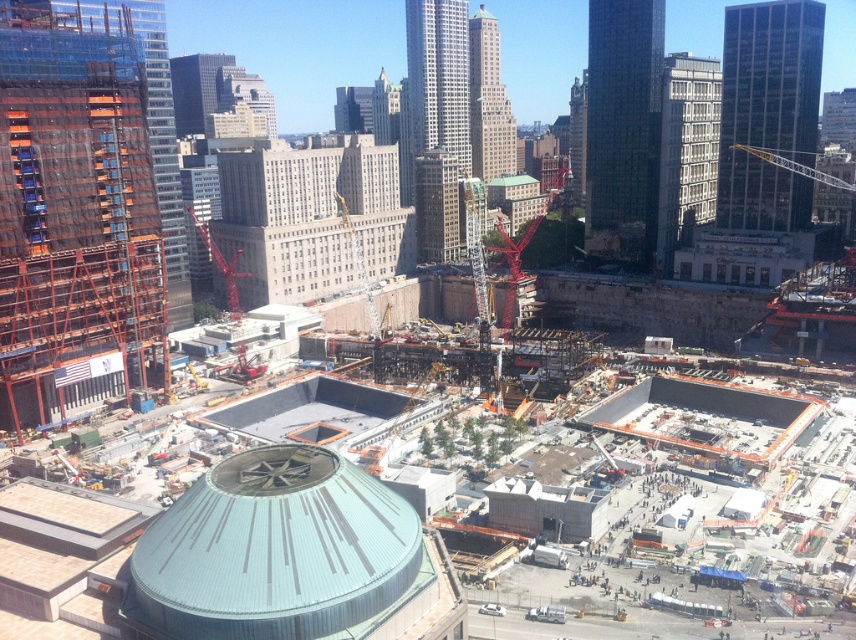
Question: Is translucent glass skyscraper at left above red metallic crane at center-left?

Choices:
 (A) no
 (B) yes

Answer: (B)

Question: Among these objects, which one is farthest from the camera?

Choices:
 (A) light gray concrete building at upper center
 (B) dark glass skyscraper at upper right
 (C) orange mesh construction at left
 (D) gold glass skyscraper at center

Answer: (A)

Question: In this image, where is translucent glass skyscraper at left located relative to metallic construction crane at center?

Choices:
 (A) left
 (B) right

Answer: (A)

Question: Which point is closer to the camera?

Choices:
 (A) (508, 138)
 (B) (663, 188)
 (C) (730, 128)

Answer: (C)

Question: Does dark glass skyscraper at upper right have a greater width compared to translucent glass skyscraper at left?

Choices:
 (A) no
 (B) yes

Answer: (A)

Question: Which of these objects is positioned farthest from the dark glass skyscraper at upper right?

Choices:
 (A) red metallic crane at center-left
 (B) metallic construction crane at center
 (C) green glass skyscraper at center
 (D) translucent glass skyscraper at left

Answer: (D)